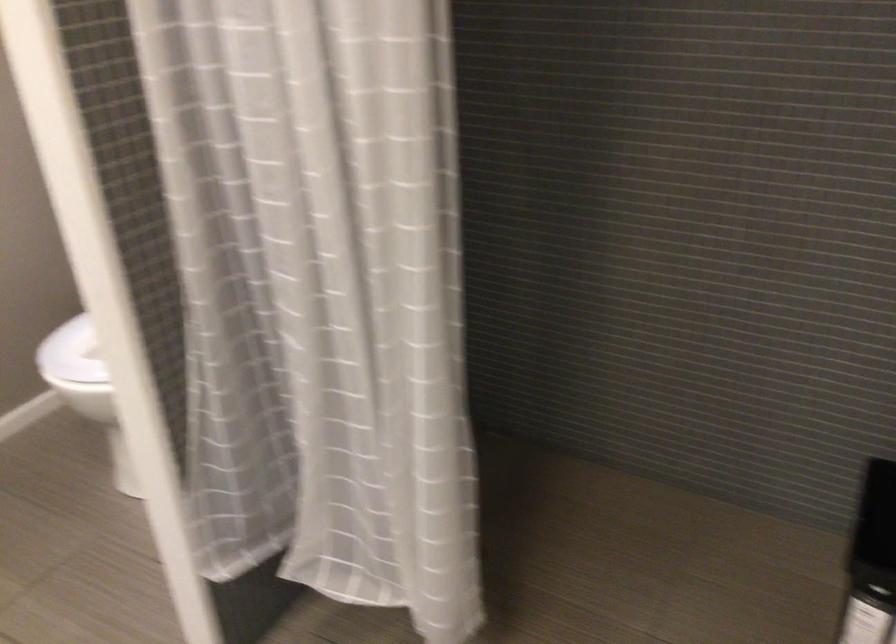
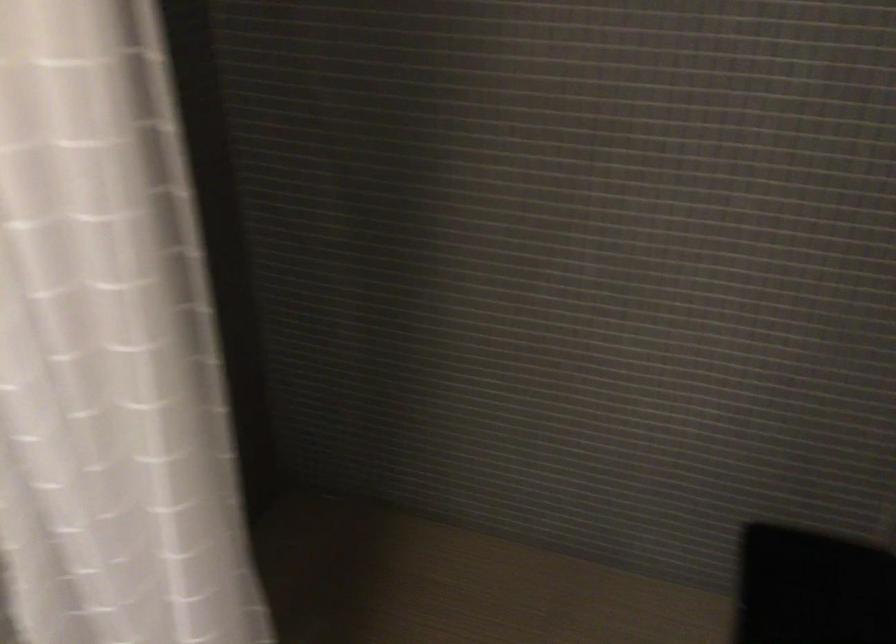
Question: The camera is either moving clockwise (left) or counter-clockwise (right) around the object. The first image is from the beginning of the video and the second image is from the end. Is the camera moving left or right when shooting the video?

Choices:
 (A) Left
 (B) Right

Answer: (A)